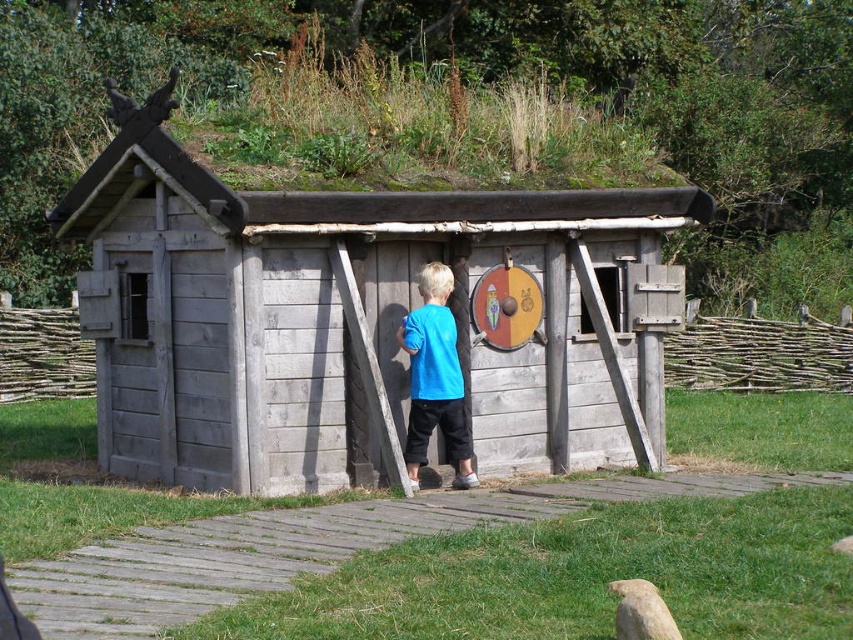
Question: Among these objects, which one is farthest from the camera?

Choices:
 (A) blue cotton shirt at center
 (B) weathered wood hut at center

Answer: (A)

Question: Is weathered wood hut at center further to the viewer compared to blue cotton shirt at center?

Choices:
 (A) no
 (B) yes

Answer: (A)

Question: Can you confirm if weathered wood hut at center is positioned to the right of blue cotton shirt at center?

Choices:
 (A) yes
 (B) no

Answer: (B)

Question: Does weathered wood hut at center have a larger size compared to blue cotton shirt at center?

Choices:
 (A) no
 (B) yes

Answer: (B)

Question: Which point appears farthest from the camera in this image?

Choices:
 (A) (408, 435)
 (B) (155, 104)

Answer: (A)